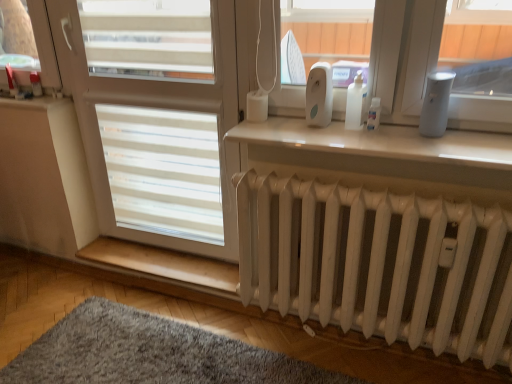
This screenshot has height=384, width=512. What are the coordinates of `vacant space situated above gray fluffy rug at lower left (from a real-world perspective)` in the screenshot? It's located at (159, 354).